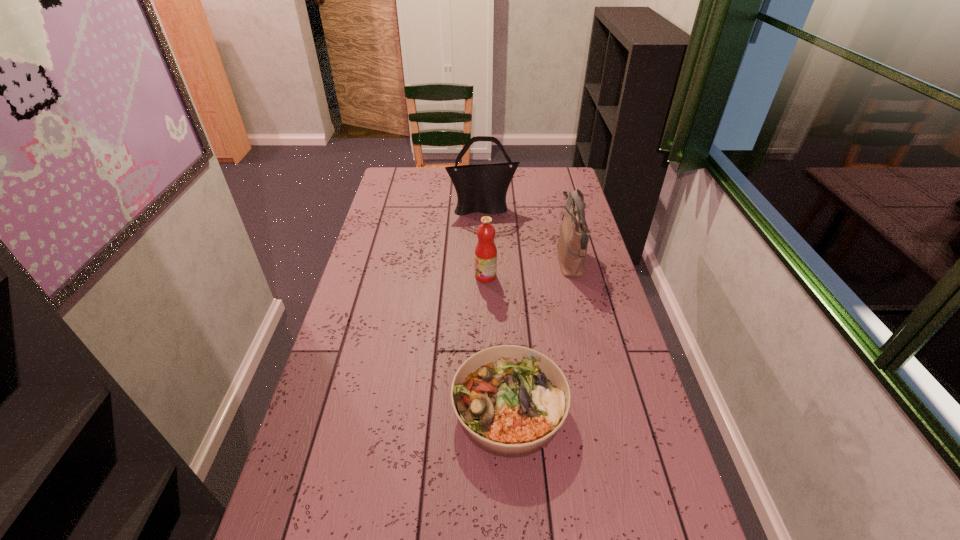
At what (x,y) coordinates should I click in order to perform the action: click on free space between the third tallest object and the nearest object. Please return your answer as a coordinate pair (x, y). Looking at the image, I should click on click(x=497, y=342).

Locate an element on the screen. vacant area that lies between the salad plate and the farther shoulder bag is located at coordinates (496, 308).

I want to click on free space between the nearer shoulder bag and the nearest object, so click(x=540, y=335).

Identify the location of empty location between the salad plate and the fruit juice. (497, 342).

Image resolution: width=960 pixels, height=540 pixels. What are the coordinates of `unoccupied position between the right shoulder bag and the second shortest object` in the screenshot? It's located at (528, 268).

At what (x,y) coordinates should I click in order to perform the action: click on blank region between the rightmost object and the shortest object. Please return your answer as a coordinate pair (x, y). This screenshot has height=540, width=960. Looking at the image, I should click on (540, 335).

Identify the location of unoccupied area between the nearest object and the second shortest object. This screenshot has height=540, width=960. (497, 342).

Where is `unoccupied position between the farther shoulder bag and the nearest object`? The width and height of the screenshot is (960, 540). unoccupied position between the farther shoulder bag and the nearest object is located at coordinates (496, 308).

Where is `free spot between the farther shoulder bag and the nearest object`? The width and height of the screenshot is (960, 540). free spot between the farther shoulder bag and the nearest object is located at coordinates tap(496, 308).

Find the location of a particular element. The width and height of the screenshot is (960, 540). object that is the nearest to the left shoulder bag is located at coordinates (572, 244).